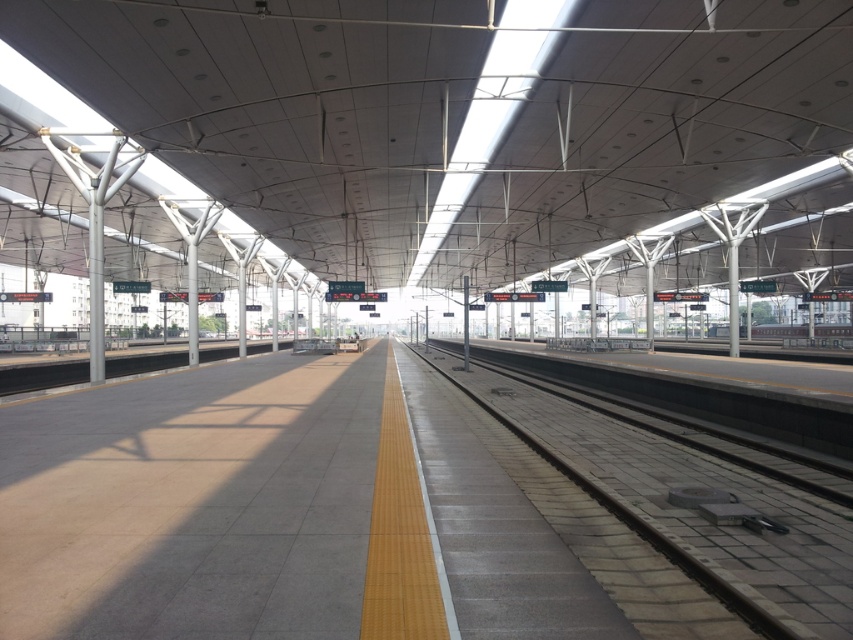
You are a maintenance worker on the platform and need to check the gray concrete train track at center and the silver metallic train at center. Which object takes up more space on the platform?

The silver metallic train at center occupies more space than the gray concrete train track at center.

You are standing on the platform and want to board the silver metallic train at center. The gray concrete train track at center is in your way. Which direction should you move to avoid it?

The gray concrete train track at center is to the left of the silver metallic train at center. To avoid the track, you should move to the right side of the silver metallic train at center.

You are standing on the platform of the train station and want to walk to the train track on the right side. The platform has a yellow tactile strip along its edge. If you walk straight from your current position at point (x=693, y=508), will you reach the gray concrete train track at center before stepping onto the yellow tactile strip?

The point (x=693, y=508) is where the gray concrete train track at center is located, so you are already at the train track and do not need to step onto the yellow tactile strip.